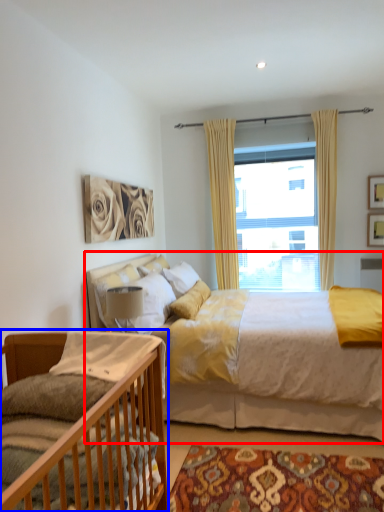
Question: Which object is further to the camera taking this photo, bed (highlighted by a red box) or bed (highlighted by a blue box)?

Choices:
 (A) bed
 (B) bed

Answer: (A)